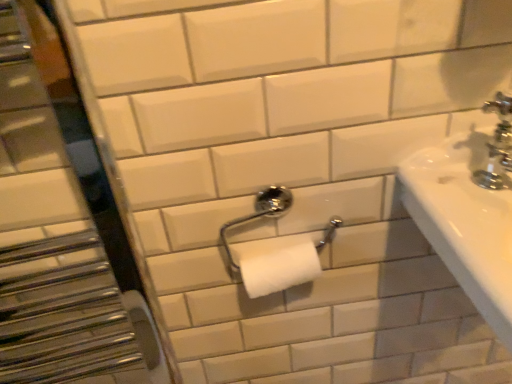
Question: Is brushed metal mirror at left placed right next to chrome metallic toilet paper holder at center?

Choices:
 (A) yes
 (B) no

Answer: (B)

Question: From a real-world perspective, is brushed metal mirror at left below chrome metallic toilet paper holder at center?

Choices:
 (A) yes
 (B) no

Answer: (B)

Question: Is brushed metal mirror at left bigger than chrome metallic toilet paper holder at center?

Choices:
 (A) yes
 (B) no

Answer: (A)

Question: Could you tell me if brushed metal mirror at left is turned towards chrome metallic toilet paper holder at center?

Choices:
 (A) no
 (B) yes

Answer: (A)

Question: Is brushed metal mirror at left smaller than chrome metallic toilet paper holder at center?

Choices:
 (A) yes
 (B) no

Answer: (B)

Question: In the image, is brushed metal mirror at left positioned in front of or behind chrome metallic faucet at upper right?

Choices:
 (A) behind
 (B) front

Answer: (B)

Question: In terms of height, does brushed metal mirror at left look taller or shorter compared to chrome metallic faucet at upper right?

Choices:
 (A) tall
 (B) short

Answer: (A)

Question: Is brushed metal mirror at left bigger or smaller than chrome metallic faucet at upper right?

Choices:
 (A) small
 (B) big

Answer: (B)

Question: From the image's perspective, is brushed metal mirror at left located above or below chrome metallic faucet at upper right?

Choices:
 (A) above
 (B) below

Answer: (B)

Question: Based on their sizes in the image, would you say chrome metallic toilet paper holder at center is bigger or smaller than brushed metal mirror at left?

Choices:
 (A) small
 (B) big

Answer: (A)

Question: Is point (278, 210) positioned closer to the camera than point (31, 158)?

Choices:
 (A) closer
 (B) farther

Answer: (B)

Question: Considering the positions of chrome metallic toilet paper holder at center and brushed metal mirror at left in the image, is chrome metallic toilet paper holder at center taller or shorter than brushed metal mirror at left?

Choices:
 (A) tall
 (B) short

Answer: (B)

Question: Is chrome metallic toilet paper holder at center to the left or to the right of brushed metal mirror at left in the image?

Choices:
 (A) right
 (B) left

Answer: (A)

Question: From their relative heights in the image, would you say chrome metallic faucet at upper right is taller or shorter than chrome metallic toilet paper holder at center?

Choices:
 (A) tall
 (B) short

Answer: (B)

Question: From the image's perspective, is chrome metallic faucet at upper right above or below chrome metallic toilet paper holder at center?

Choices:
 (A) below
 (B) above

Answer: (B)